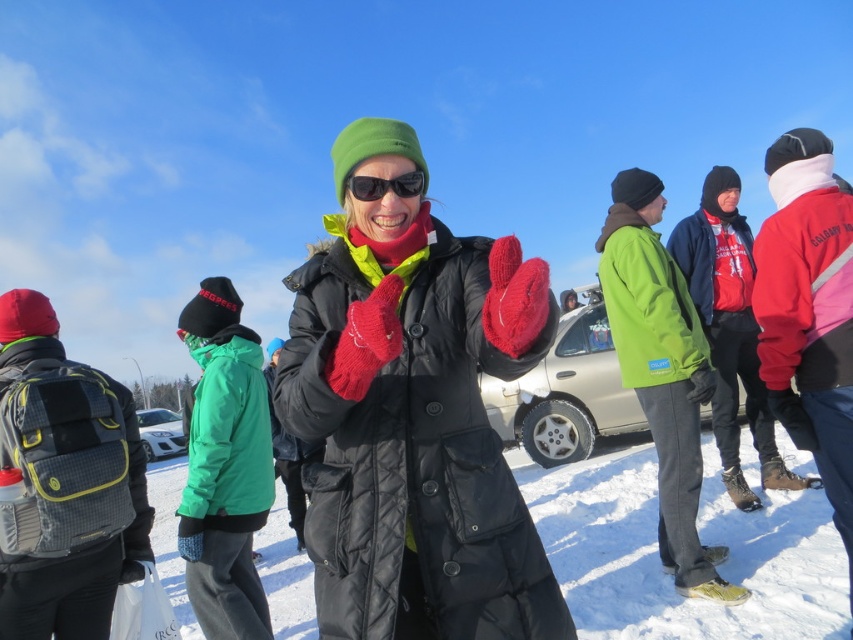
Question: Which of the following is the closest to the observer?

Choices:
 (A) black plastic sunglasses at center
 (B) gray mesh backpack at left

Answer: (A)

Question: From the image, what is the correct spatial relationship of metallic silver car at center in relation to black plastic sunglasses at center?

Choices:
 (A) above
 (B) below

Answer: (B)

Question: Which of the following is the farthest from the observer?

Choices:
 (A) (88, 458)
 (B) (815, 161)

Answer: (B)

Question: Does knitted wool mittens at center have a smaller size compared to metallic silver car at center?

Choices:
 (A) no
 (B) yes

Answer: (B)

Question: Which object is closer to the camera taking this photo?

Choices:
 (A) white matte car at center
 (B) gray mesh backpack at left

Answer: (B)

Question: Does knitted wool mittens at center appear on the right side of red fleece jacket at right?

Choices:
 (A) yes
 (B) no

Answer: (B)